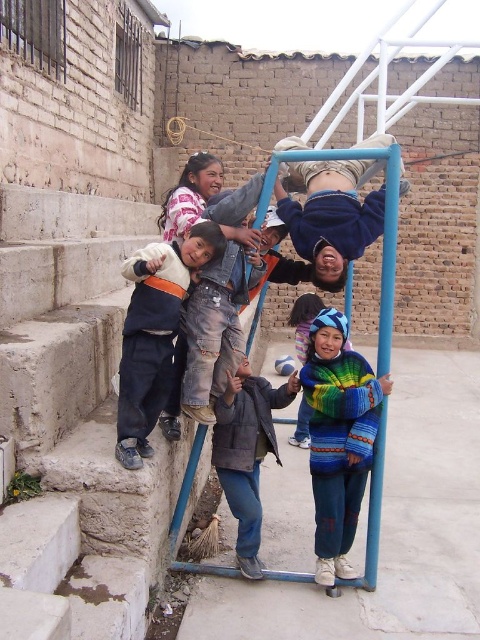
You are a photographer trying to capture a photo of the denim jacket at left and the blue fleece jacket at center. Which jacket should you focus on first if you want to include both in your shot without moving the camera?

The denim jacket at left should be focused on first because it is positioned on the left side of the blue fleece jacket at center, so by starting with the denim jacket at left, you can ensure both jackets are included in the frame without needing to adjust the camera position.